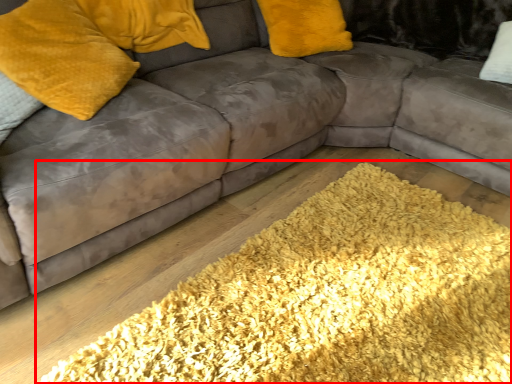
Question: From the image, what is the correct spatial relationship of mat (annotated by the red box) in relation to pillow?

Choices:
 (A) right
 (B) left

Answer: (A)